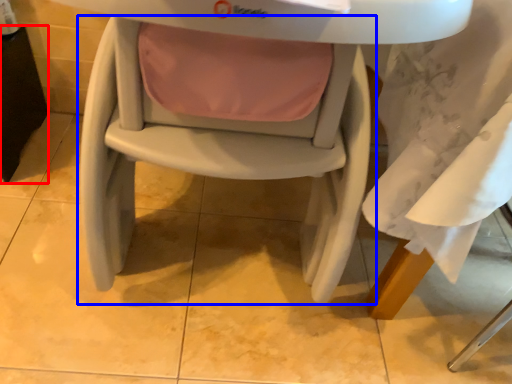
Question: Which object appears closest to the camera in this image, table (highlighted by a red box) or chair (highlighted by a blue box)?

Choices:
 (A) table
 (B) chair

Answer: (B)